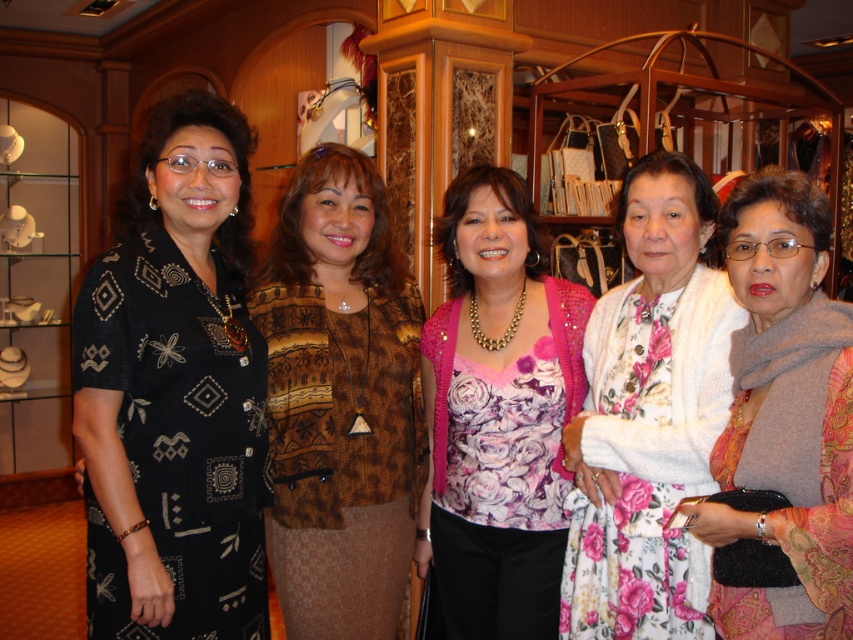
Between floral fabric dress at center and gray wool scarf at center, which one appears on the right side from the viewer's perspective?

gray wool scarf at center

Between point (721, 396) and point (827, 355), which one is positioned behind?

The point (721, 396) is more distant.

At what (x,y) coordinates should I click in order to perform the action: click on floral fabric dress at center. Please return your answer as a coordinate pair (x, y). The width and height of the screenshot is (853, 640). Looking at the image, I should click on (648, 416).

Locate an element on the screen. The height and width of the screenshot is (640, 853). floral fabric dress at center is located at coordinates (648, 416).

In the scene shown: Measure the distance from pink floral blouse at center to floral fabric dress at center.

pink floral blouse at center and floral fabric dress at center are 8.00 inches apart from each other.

Where is `pink floral blouse at center`? pink floral blouse at center is located at coordinates (497, 413).

Is point (479, 579) positioned before point (715, 380)?

That is False.

Find the location of `pink floral blouse at center`. pink floral blouse at center is located at coordinates (497, 413).

Is pink floral blouse at center wider than gray wool scarf at center?

Indeed, pink floral blouse at center has a greater width compared to gray wool scarf at center.

Does pink floral blouse at center appear under gray wool scarf at center?

Indeed, pink floral blouse at center is positioned under gray wool scarf at center.

The image size is (853, 640). Describe the element at coordinates (497, 413) in the screenshot. I see `pink floral blouse at center` at that location.

The image size is (853, 640). Identify the location of pink floral blouse at center. (497, 413).